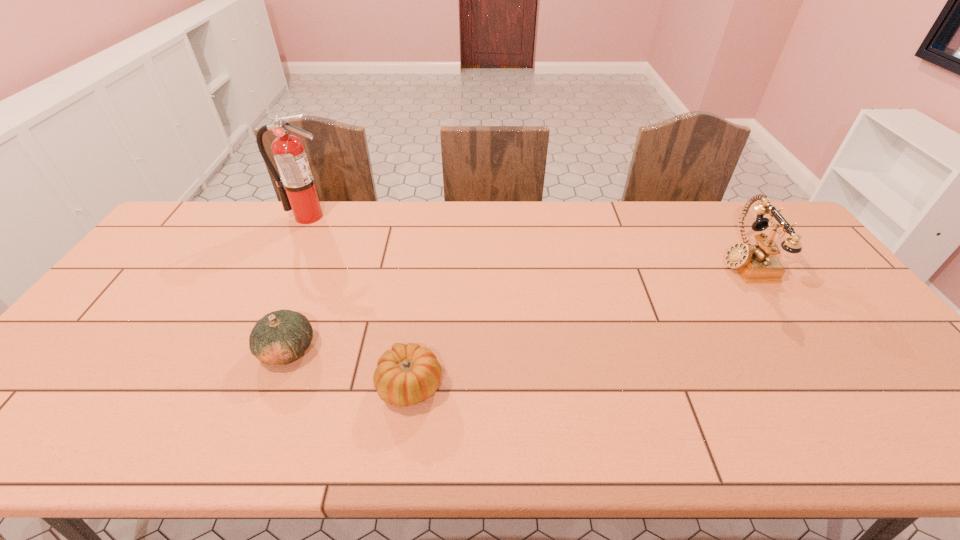
Where is `vacant space at the near edge of the desktop`? The image size is (960, 540). vacant space at the near edge of the desktop is located at coordinates (202, 444).

This screenshot has height=540, width=960. I want to click on vacant area at the right edge of the desktop, so point(813,256).

This screenshot has height=540, width=960. In order to click on free point at the far left corner in this screenshot , I will do `click(196, 211)`.

In the image, there is a desktop. Where is `vacant region at the near left corner`? vacant region at the near left corner is located at coordinates (55, 419).

Image resolution: width=960 pixels, height=540 pixels. I want to click on free space at the far right corner of the desktop, so click(x=752, y=209).

Where is `free space between the rightmost object and the farthest object`? free space between the rightmost object and the farthest object is located at coordinates (525, 239).

Where is `unoccupied area between the taller gourd and the tallest object`? This screenshot has width=960, height=540. unoccupied area between the taller gourd and the tallest object is located at coordinates (298, 283).

Find the location of `free space that is in between the shorter gourd and the third nearest object`. free space that is in between the shorter gourd and the third nearest object is located at coordinates click(577, 323).

Locate an element on the screen. The width and height of the screenshot is (960, 540). free space that is in between the shortest object and the farthest object is located at coordinates (359, 301).

Where is `vacant space that's between the telephone and the fire extinguisher`? The width and height of the screenshot is (960, 540). vacant space that's between the telephone and the fire extinguisher is located at coordinates (x=525, y=239).